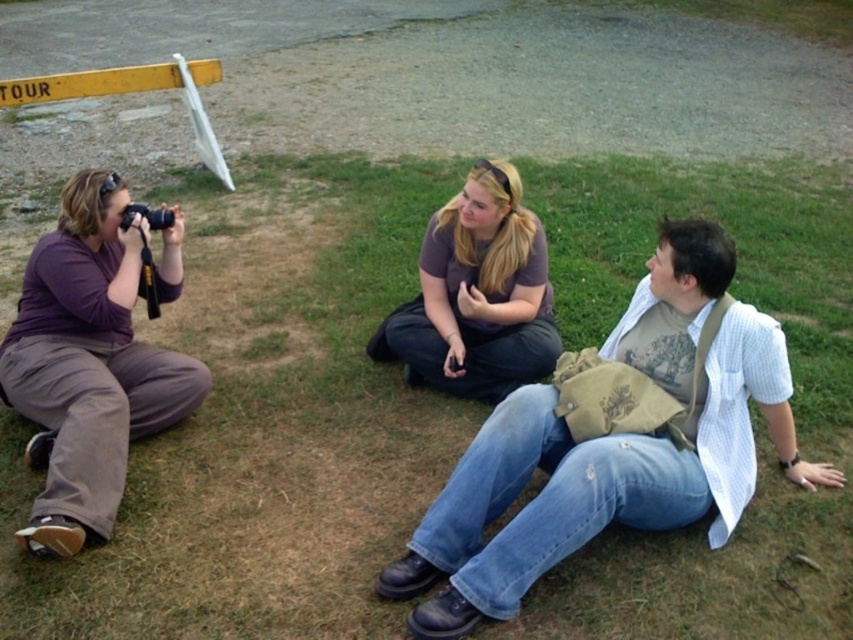
Question: Considering the real-world distances, which object is farthest from the black plastic camera at left?

Choices:
 (A) blue jeans at center
 (B) matte purple shirt at left
 (C) yellow painted metal at upper left

Answer: (C)

Question: Can you confirm if purple cotton shirt at center is bigger than yellow painted metal at upper left?

Choices:
 (A) no
 (B) yes

Answer: (A)

Question: Is blue jeans at center above matte purple shirt at left?

Choices:
 (A) yes
 (B) no

Answer: (B)

Question: Which point appears farthest from the camera in this image?

Choices:
 (A) (418, 621)
 (B) (148, 218)
 (C) (47, 397)
 (D) (21, 81)

Answer: (D)

Question: Among these objects, which one is nearest to the camera?

Choices:
 (A) yellow painted metal at upper left
 (B) blue jeans at center

Answer: (B)

Question: Is the position of yellow painted metal at upper left less distant than that of black plastic camera at left?

Choices:
 (A) yes
 (B) no

Answer: (B)